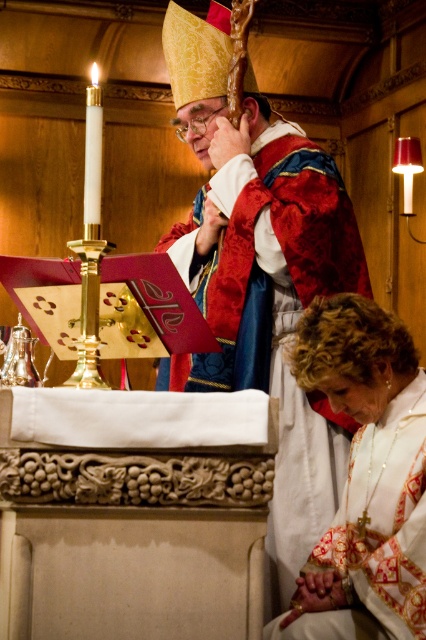
Question: Which object is farther from the camera taking this photo?

Choices:
 (A) velvet red robe at center
 (B) white embroidered robe at lower right

Answer: (A)

Question: Does velvet red robe at center have a greater width compared to white embroidered robe at lower right?

Choices:
 (A) yes
 (B) no

Answer: (A)

Question: Which object is farther from the camera taking this photo?

Choices:
 (A) white embroidered robe at lower right
 (B) velvet red robe at center

Answer: (B)

Question: Where is velvet red robe at center located in relation to white embroidered robe at lower right in the image?

Choices:
 (A) below
 (B) above

Answer: (B)

Question: Is velvet red robe at center thinner than white embroidered robe at lower right?

Choices:
 (A) yes
 (B) no

Answer: (B)